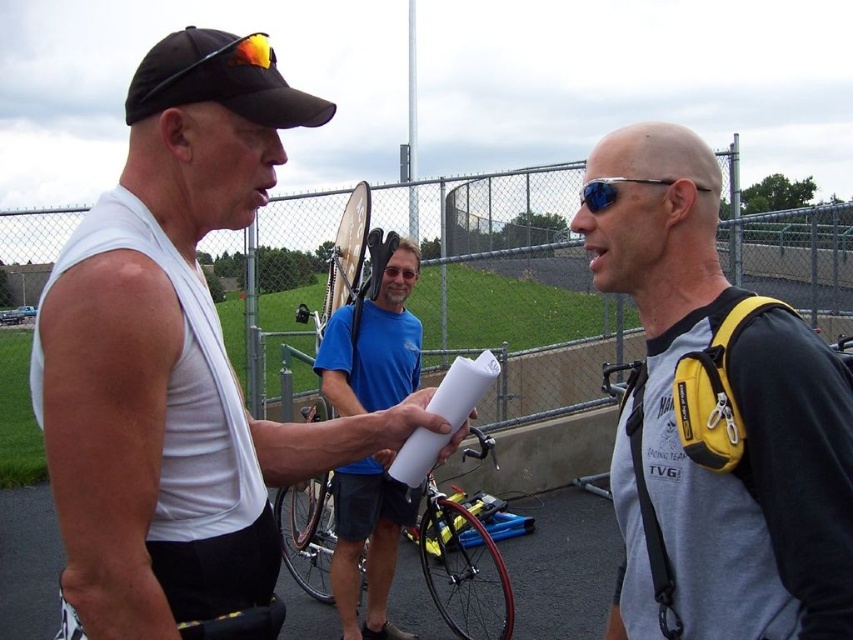
You are a photographer trying to capture both the blue fabric shirt at center and the black matte baseball cap at upper left in a single frame. Given their sizes, which object will appear larger in your photo?

The blue fabric shirt at center will appear larger in the photo because it is bigger than the black matte baseball cap at upper left according to the description.

You are a delivery person who needs to load a shiny red bicycle at center and blue reflective lens sunglasses at center into a truck. The truck has a height limit of 1.5 meters. Can both items be loaded without exceeding the height limit?

The shiny red bicycle at center is much taller than blue reflective lens sunglasses at center. Since the bicycle is taller, it might exceed the truck height limit of 1.5 meters. The sunglasses are shorter, so they can fit. However, without knowing the exact height of the bicycle, we cannot confirm if both can be loaded safely.